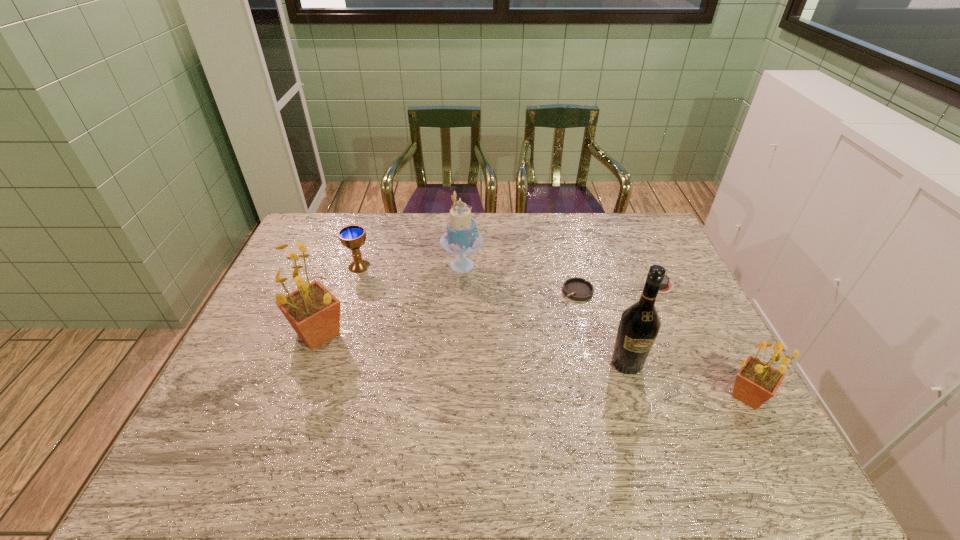
In order to click on the farther sunflower in this screenshot , I will do `click(314, 312)`.

Image resolution: width=960 pixels, height=540 pixels. I want to click on the left sunflower, so click(314, 312).

Locate an element on the screen. the nearer sunflower is located at coordinates (756, 382).

Where is `the fourth tallest object`? the fourth tallest object is located at coordinates (756, 382).

The image size is (960, 540). In order to click on cake in this screenshot , I will do `click(462, 237)`.

The height and width of the screenshot is (540, 960). What are the coordinates of `chocolate cake` in the screenshot? It's located at (667, 285).

Where is `the fifth tallest object`? the fifth tallest object is located at coordinates (352, 237).

What are the coordinates of `ashtray` in the screenshot? It's located at (578, 289).

This screenshot has height=540, width=960. Find the location of `wine bottle`. wine bottle is located at coordinates (639, 325).

This screenshot has height=540, width=960. What are the coordinates of `vacant space located at the front of the left sunflower with flowers visible` in the screenshot? It's located at (255, 334).